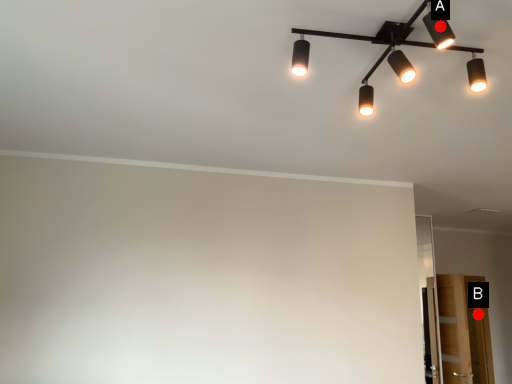
Question: Two points are circled on the image, labeled by A and B beside each circle. Which point is closer to the camera?

Choices:
 (A) A is closer
 (B) B is closer

Answer: (A)